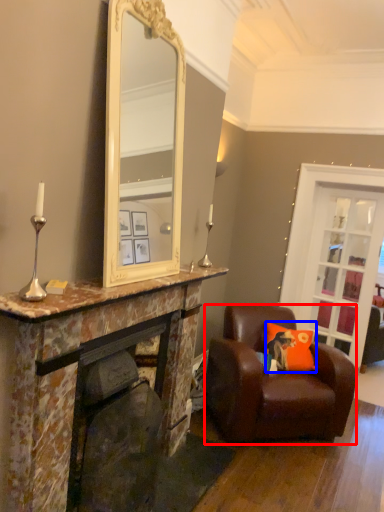
Question: Which object appears closest to the camera in this image, chair (highlighted by a red box) or cushion (highlighted by a blue box)?

Choices:
 (A) chair
 (B) cushion

Answer: (A)